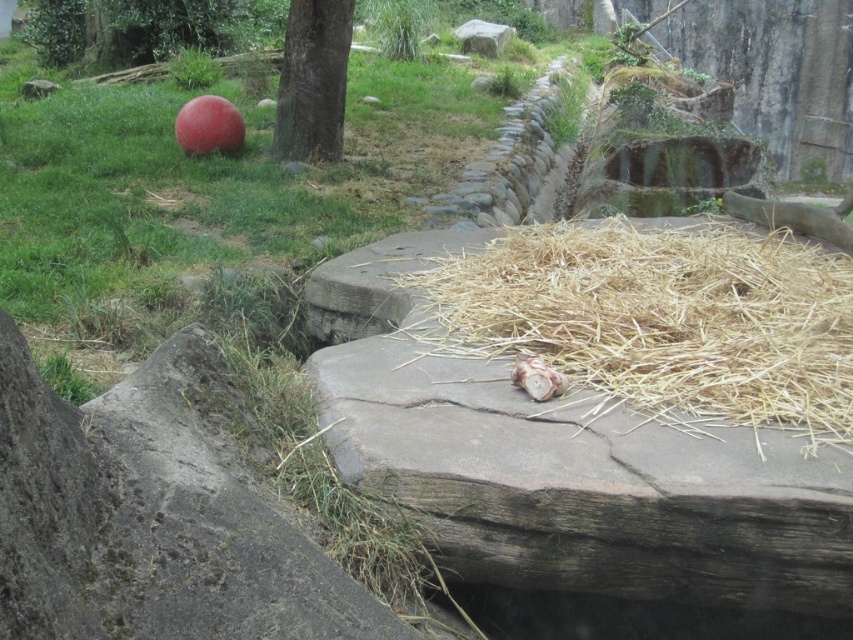
Question: Which of the following is the closest to the observer?

Choices:
 (A) brown rough bark tree at upper center
 (B) brown textured log at center
 (C) brown straw at center
 (D) smooth gray rock at upper center

Answer: (C)

Question: Does brown straw at center appear over brown textured log at center?

Choices:
 (A) no
 (B) yes

Answer: (B)

Question: Which of the following is the farthest from the observer?

Choices:
 (A) (328, 24)
 (B) (547, 396)

Answer: (A)

Question: Which object is the farthest from the brown rough bark tree at upper center?

Choices:
 (A) smooth gray rock at upper center
 (B) brown straw at center

Answer: (A)

Question: Can you confirm if brown rough bark tree at upper center is smaller than brown textured log at center?

Choices:
 (A) yes
 (B) no

Answer: (B)

Question: Is brown textured log at center to the right of smooth gray rock at upper center from the viewer's perspective?

Choices:
 (A) yes
 (B) no

Answer: (B)